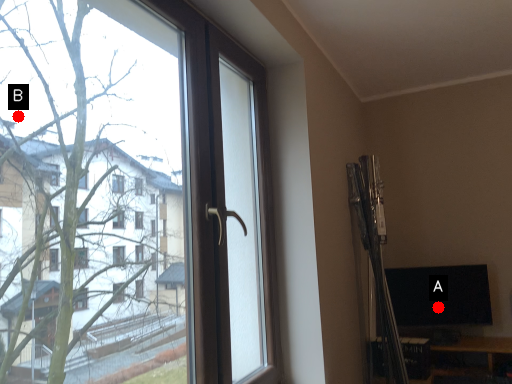
Question: Two points are circled on the image, labeled by A and B beside each circle. Which of the following is the closest to the observer?

Choices:
 (A) A is closer
 (B) B is closer

Answer: (B)